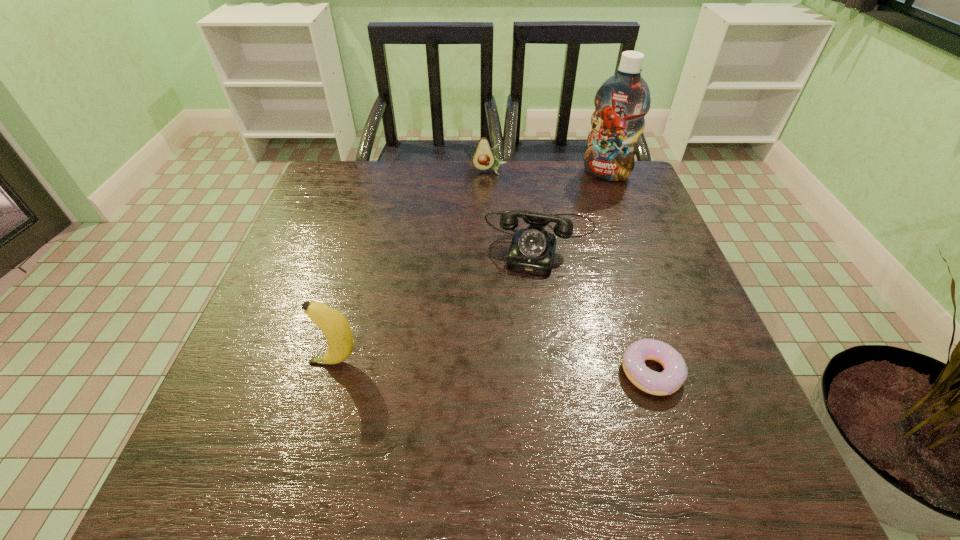
Locate an element on the screen. The width and height of the screenshot is (960, 540). object located at the near edge is located at coordinates (675, 372).

At what (x,y) coordinates should I click in order to perform the action: click on object located at the left edge. Please return your answer as a coordinate pair (x, y). Looking at the image, I should click on (334, 325).

Find the location of a particular element. The width and height of the screenshot is (960, 540). doughnut at the right edge is located at coordinates (675, 372).

Where is `shampoo that is at the right edge`? The width and height of the screenshot is (960, 540). shampoo that is at the right edge is located at coordinates (622, 101).

Locate an element on the screen. This screenshot has height=540, width=960. object that is positioned at the far right corner is located at coordinates (622, 101).

The height and width of the screenshot is (540, 960). What are the coordinates of `object that is at the near right corner` in the screenshot? It's located at (675, 372).

The image size is (960, 540). I want to click on free space at the far edge of the desktop, so click(423, 198).

In the image, there is a desktop. In order to click on vacant space at the near edge in this screenshot , I will do `click(563, 427)`.

Locate an element on the screen. The width and height of the screenshot is (960, 540). free space at the left edge is located at coordinates click(356, 213).

Locate an element on the screen. The width and height of the screenshot is (960, 540). free space at the right edge of the desktop is located at coordinates (673, 311).